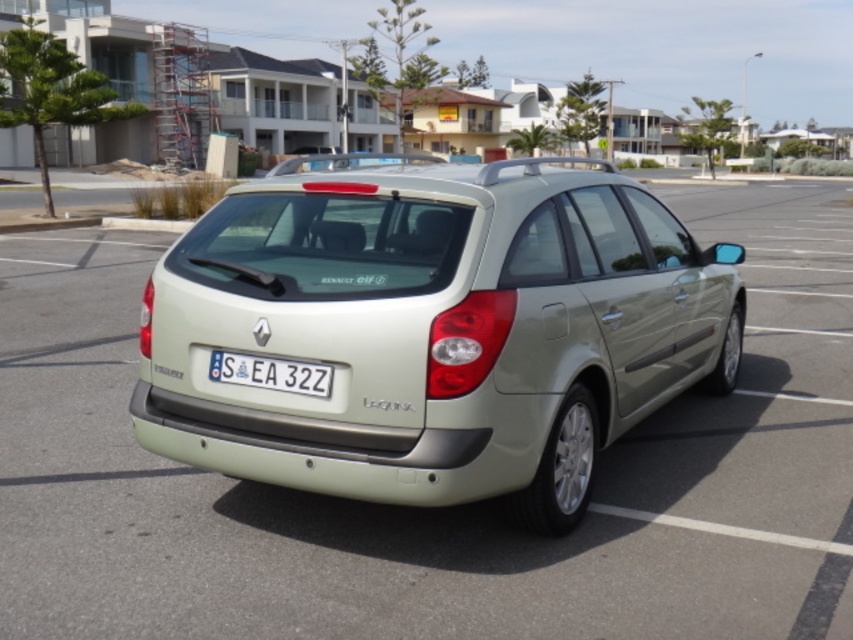
Question: Which point is closer to the camera?

Choices:
 (A) white plastic license plate at center
 (B) satin beige hatchback at center

Answer: (B)

Question: Among these points, which one is farthest from the camera?

Choices:
 (A) (277, 364)
 (B) (660, 288)

Answer: (B)

Question: Is satin beige hatchback at center further to camera compared to white plastic license plate at center?

Choices:
 (A) yes
 (B) no

Answer: (B)

Question: Does satin beige hatchback at center have a smaller size compared to white plastic license plate at center?

Choices:
 (A) no
 (B) yes

Answer: (A)

Question: Does satin beige hatchback at center have a greater width compared to white plastic license plate at center?

Choices:
 (A) yes
 (B) no

Answer: (A)

Question: Which point is farther from the camera taking this photo?

Choices:
 (A) (457, 396)
 (B) (271, 388)

Answer: (B)